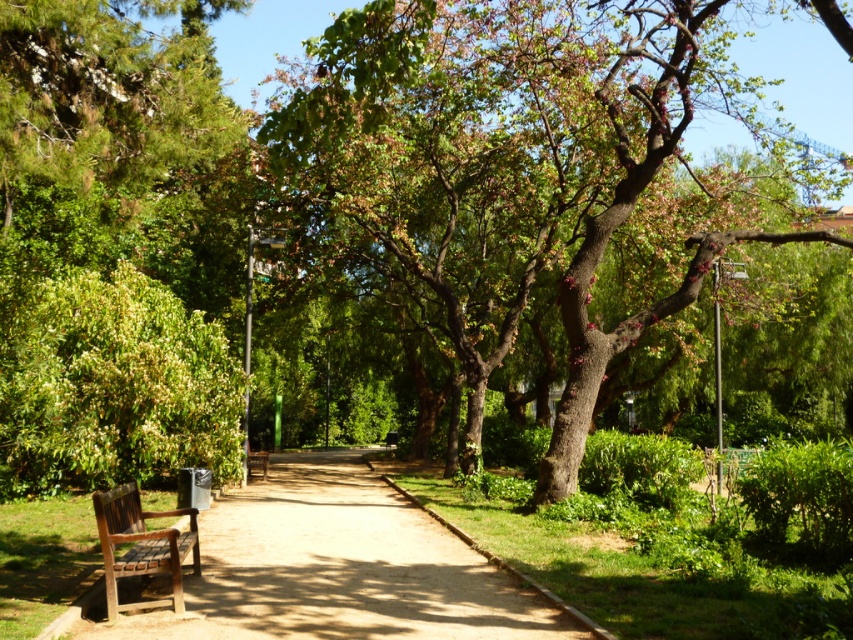
Question: Does wooden bench at lower left lie in front of brown wooden bench at center?

Choices:
 (A) yes
 (B) no

Answer: (A)

Question: Can you confirm if wooden bench at lower left is positioned below brown wooden bench at center?

Choices:
 (A) no
 (B) yes

Answer: (A)

Question: Which object appears closest to the camera in this image?

Choices:
 (A) green textured tree at center
 (B) wooden bench at lower left

Answer: (A)

Question: Which object is farther from the camera taking this photo?

Choices:
 (A) brown wooden bench at center
 (B) wooden bench at lower left
 (C) brown wooden pavement at lower left

Answer: (A)

Question: Among these points, which one is nearest to the camera?

Choices:
 (A) [260, 456]
 (B) [380, 547]
 (C) [640, 294]
 (D) [131, 481]

Answer: (D)

Question: Is green textured tree at center to the left of wooden bench at lower left from the viewer's perspective?

Choices:
 (A) no
 (B) yes

Answer: (A)